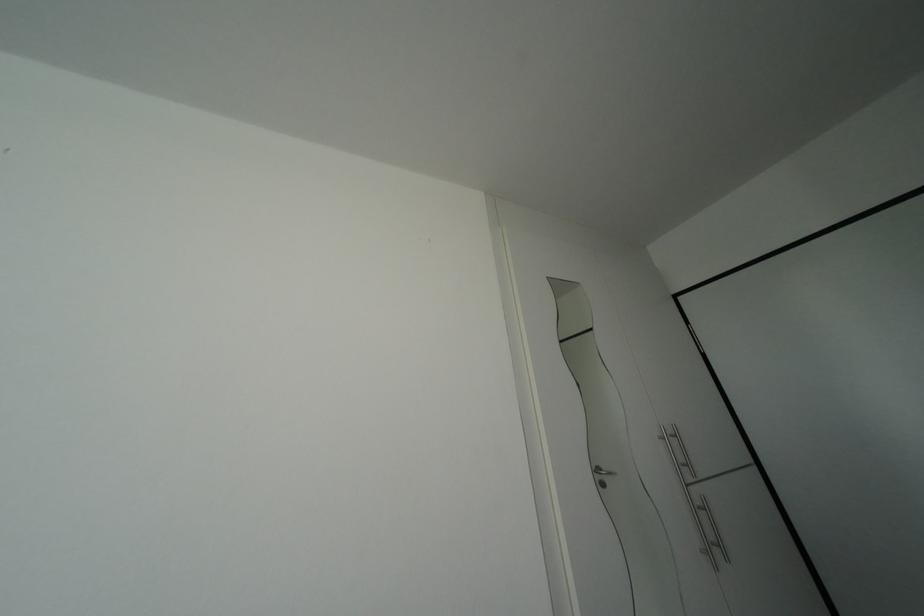
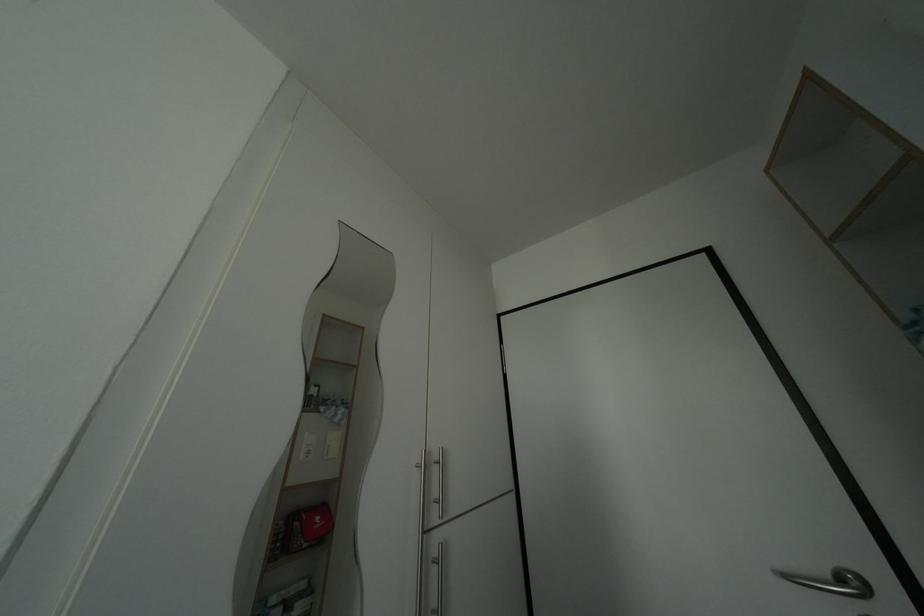
Question: The camera is either moving clockwise (left) or counter-clockwise (right) around the object. The first image is from the beginning of the video and the second image is from the end. Is the camera moving left or right when shooting the video?

Choices:
 (A) Left
 (B) Right

Answer: (A)